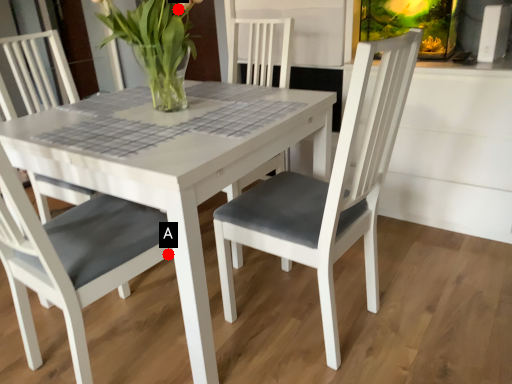
Question: Two points are circled on the image, labeled by A and B beside each circle. Among these points, which one is nearest to the camera?

Choices:
 (A) A is closer
 (B) B is closer

Answer: (A)